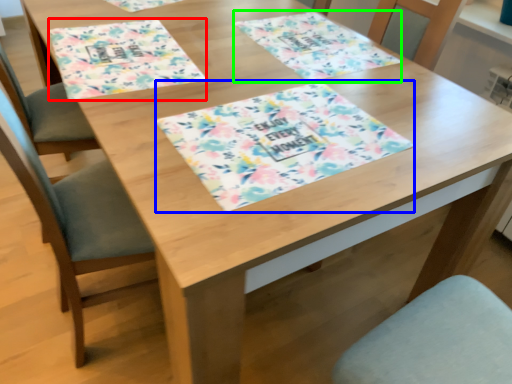
Question: Which is nearer to the place mat (highlighted by a red box)? tablecloth (highlighted by a blue box) or place mat (highlighted by a green box).

Choices:
 (A) tablecloth
 (B) place mat

Answer: (A)